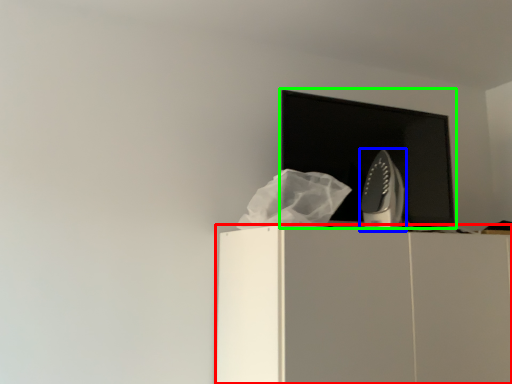
Question: Which object is the closest to the furniture (highlighted by a red box)? Choose among these: home appliance (highlighted by a blue box) or computer monitor (highlighted by a green box).

Choices:
 (A) home appliance
 (B) computer monitor

Answer: (A)